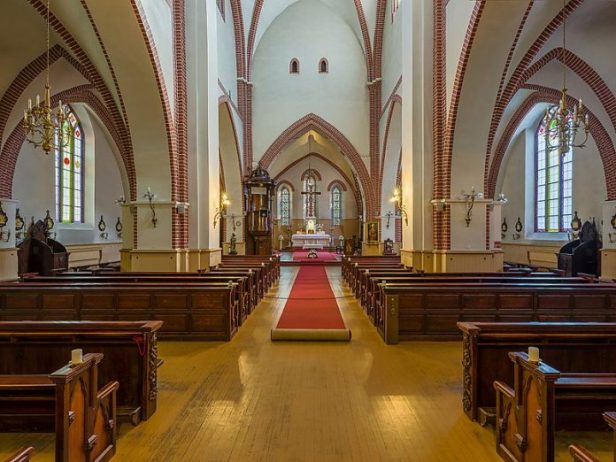
You are a GUI agent. You are given a task and a screenshot of the screen. Output one action in this format:
    pyautogui.click(x=<x>, y=<y>)
    Task: Click on the windows
    
    Given the screenshot: What is the action you would take?
    pyautogui.click(x=556, y=186)